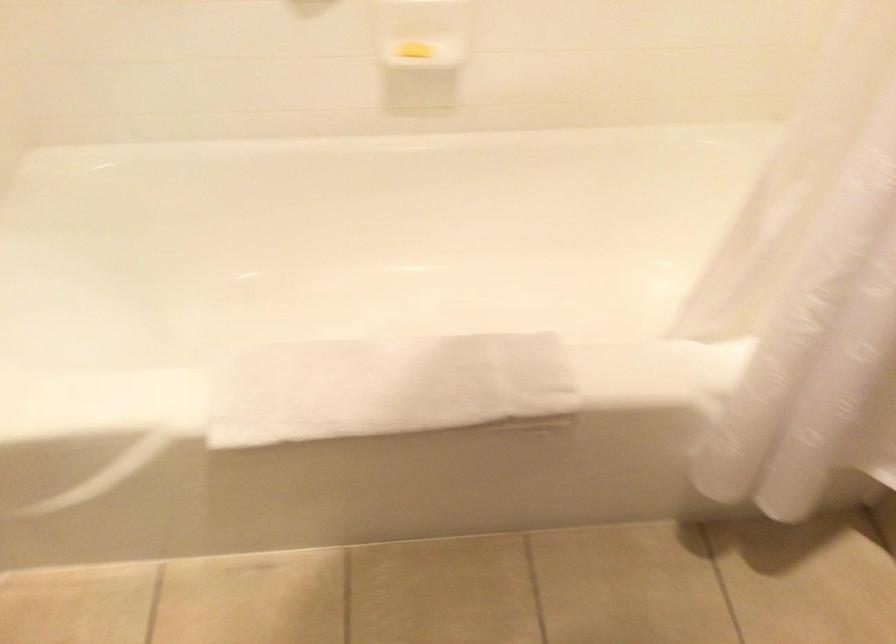
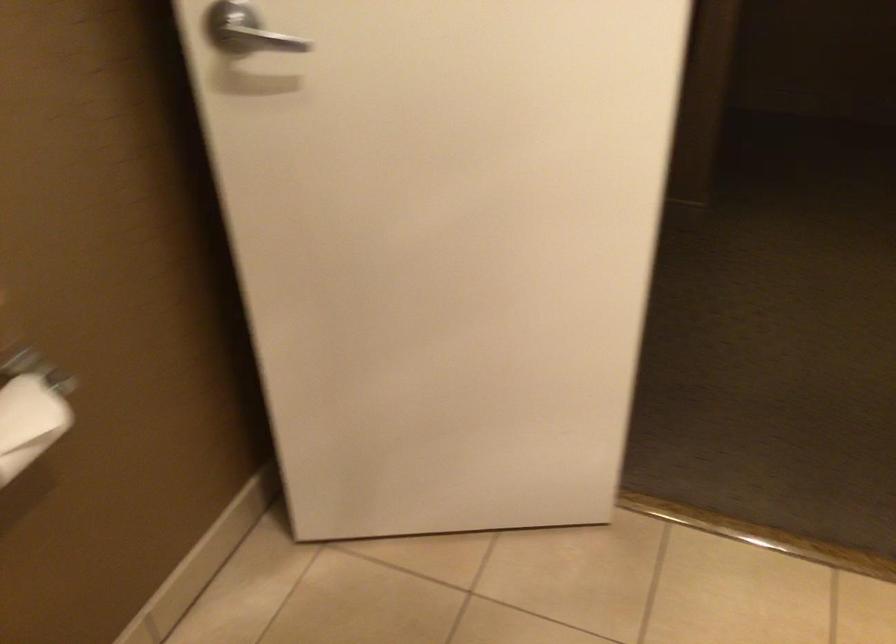
How did the camera likely rotate?

The camera rotated toward left-down.